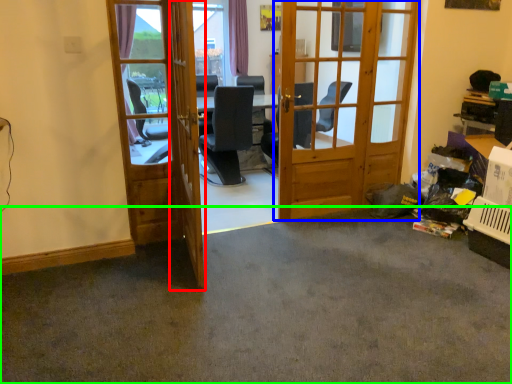
Question: Based on their relative distances, which object is farther from screen door (highlighted by a red box)? Choose from door (highlighted by a blue box) and concrete (highlighted by a green box).

Choices:
 (A) door
 (B) concrete

Answer: (A)